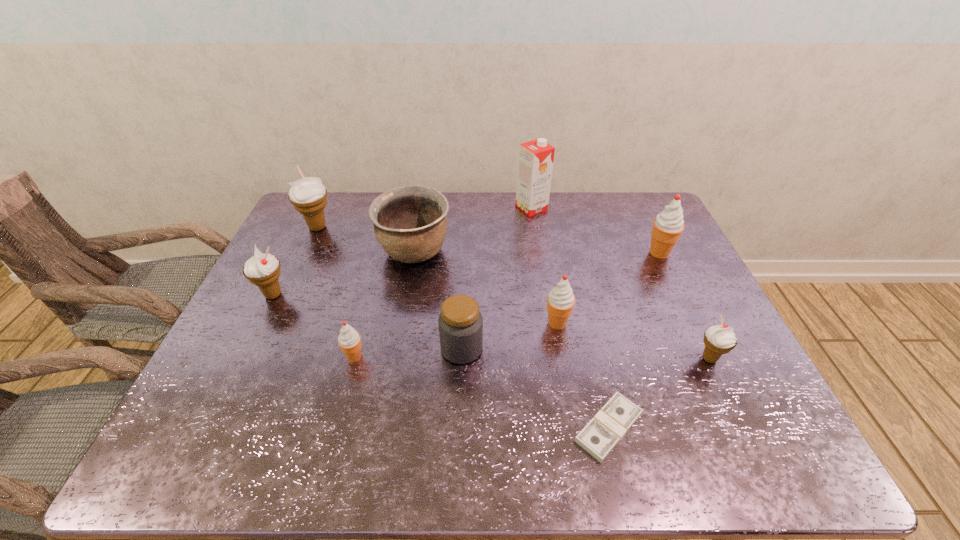
Image resolution: width=960 pixels, height=540 pixels. Find the location of `the farthest object`. the farthest object is located at coordinates (535, 159).

Locate an element on the screen. the tallest object is located at coordinates (535, 159).

Where is `the farthest icecream`? The height and width of the screenshot is (540, 960). the farthest icecream is located at coordinates (308, 195).

Locate an element on the screen. The image size is (960, 540). the farthest white icecream is located at coordinates (308, 195).

Where is `the farthest red icecream`? the farthest red icecream is located at coordinates (668, 225).

The height and width of the screenshot is (540, 960). In order to click on the biggest red icecream in this screenshot , I will do `click(668, 225)`.

The height and width of the screenshot is (540, 960). Find the location of `pottery`. pottery is located at coordinates (410, 223).

This screenshot has width=960, height=540. In order to click on the second nearest white icecream in this screenshot , I will do (263, 270).

The height and width of the screenshot is (540, 960). I want to click on the second smallest white icecream, so click(263, 270).

Where is `the third nearest icecream`? the third nearest icecream is located at coordinates coord(560,301).